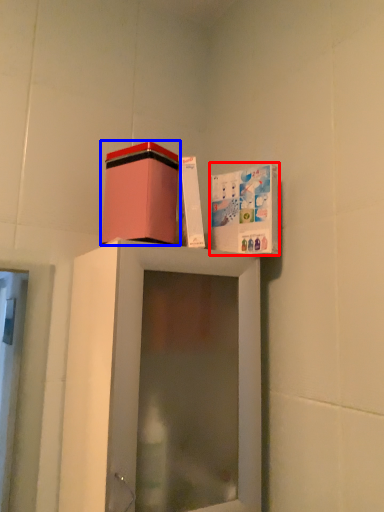
Question: Which of the following is the farthest to the observer, cabinet (highlighted by a red box) or cardboard box (highlighted by a blue box)?

Choices:
 (A) cabinet
 (B) cardboard box

Answer: (A)